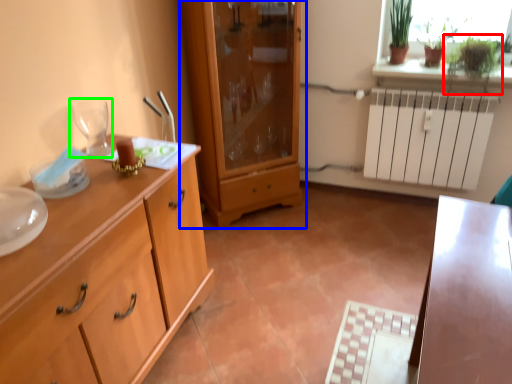
Question: Which is farther away from plant (highlighted by a red box)? cupboard (highlighted by a blue box) or wine glass (highlighted by a green box)?

Choices:
 (A) cupboard
 (B) wine glass

Answer: (B)